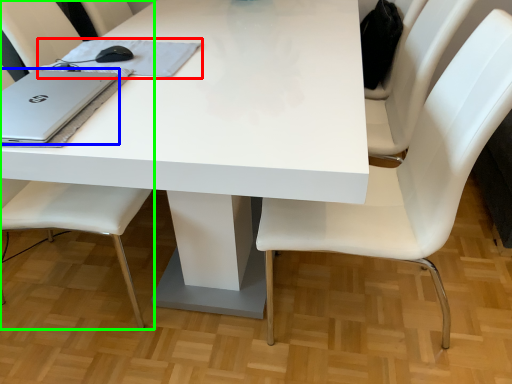
Question: Which object is the closest to the notebook (highlighted by a red box)? Choose among these: laptop (highlighted by a blue box) or chair (highlighted by a green box).

Choices:
 (A) laptop
 (B) chair

Answer: (A)